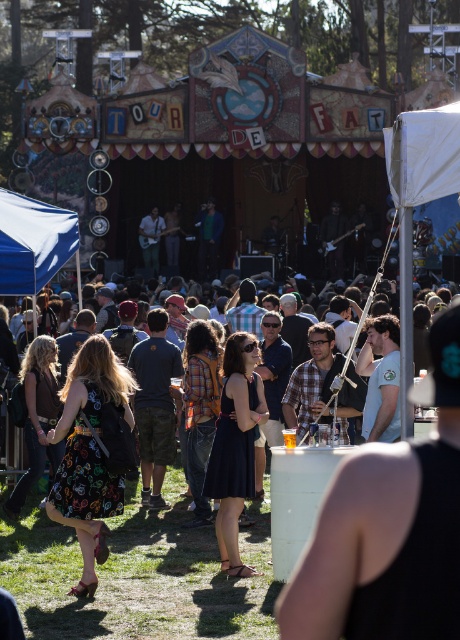
Does point (235, 492) lie behind point (26, 260)?

No, (235, 492) is in front of (26, 260).

Looking at this image, does dark blue dress at center have a greater height compared to blue fabric canopy at upper left?

Indeed, dark blue dress at center has a greater height compared to blue fabric canopy at upper left.

Who is more forward, (252, 420) or (4, 273)?

Point (252, 420)

Where is `dark blue dress at center`? The height and width of the screenshot is (640, 460). dark blue dress at center is located at coordinates (235, 445).

Can you confirm if printed fabric dress at center is bigger than dark blue dress at center?

Correct, printed fabric dress at center is larger in size than dark blue dress at center.

What are the coordinates of `printed fabric dress at center` in the screenshot? It's located at 88,452.

Does printed fabric dress at center appear on the left side of white fabric canopy at upper right?

Indeed, printed fabric dress at center is positioned on the left side of white fabric canopy at upper right.

Does printed fabric dress at center appear over white fabric canopy at upper right?

No, printed fabric dress at center is not above white fabric canopy at upper right.

Which is behind, point (78, 413) or point (408, 161)?

The point (78, 413) is more distant.

Find the location of `printed fabric dress at center`. printed fabric dress at center is located at coordinates (88, 452).